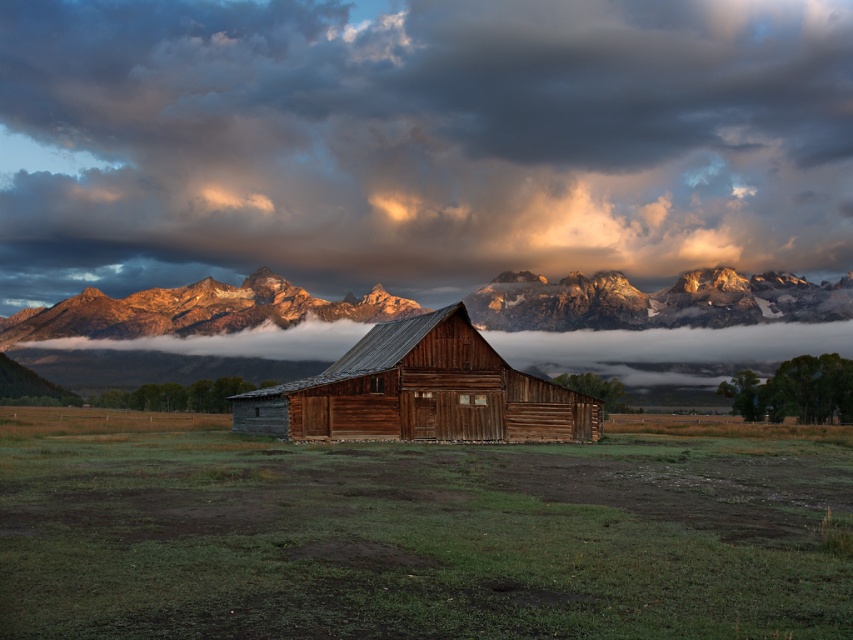
You are an artist painting the rural landscape. You want to ensure the cloudy sky at upper center and rugged stone mountains at upper center are proportionally accurate. Which of these two should you make smaller in your painting?

The cloudy sky at upper center is smaller than rugged stone mountains at upper center, so you should make the cloudy sky at upper center smaller in your painting.

Looking at the cloudy sky at upper center and the rugged stone mountains at upper center, which one is positioned to the left?

The cloudy sky at upper center is to the left of the rugged stone mountains at upper center.